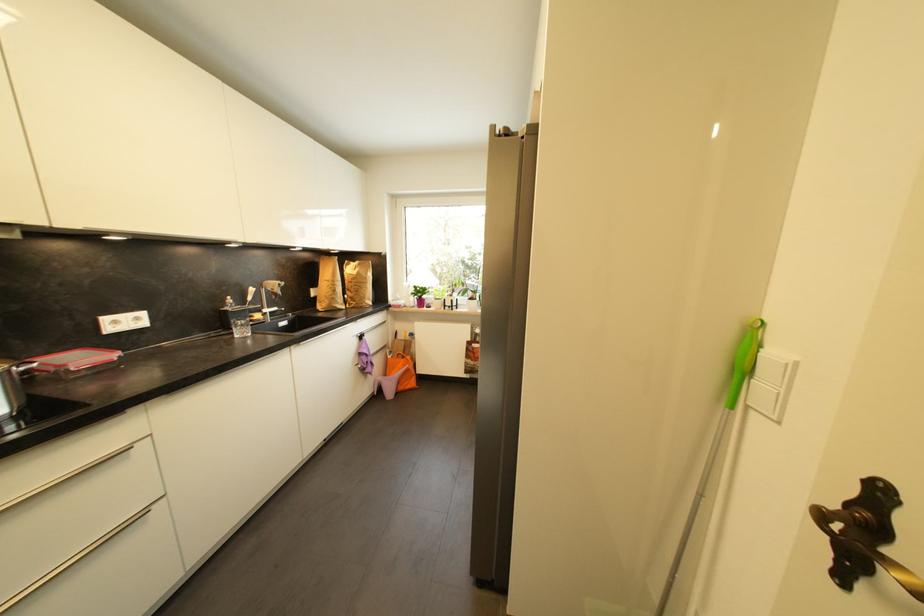
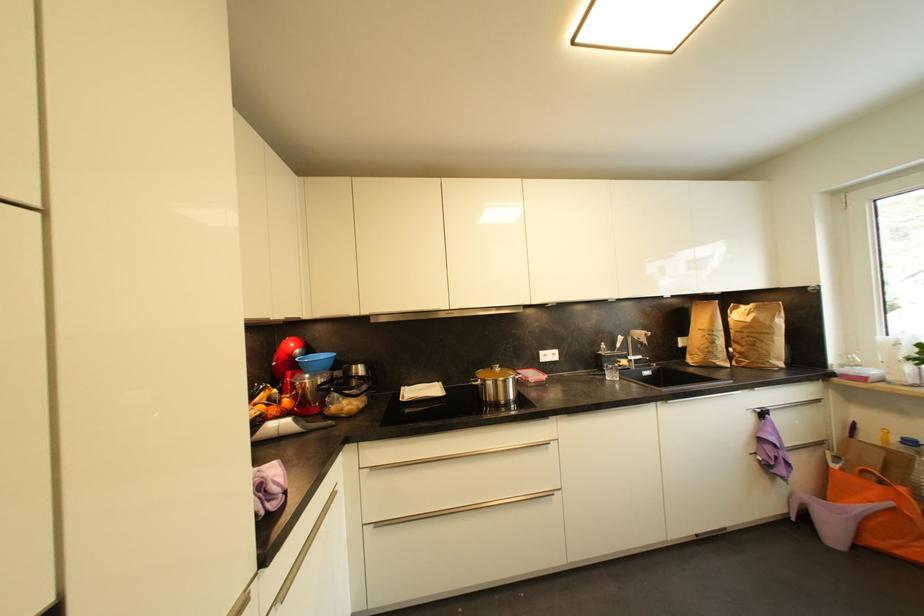
Question: I am providing you with two images of the same scene from different viewpoints. After the viewpoint changes to image2, which objects are now occluded?

Choices:
 (A) blue bowl
 (B) purple plastic object
 (C) small red container
 (D) none of these

Answer: (D)